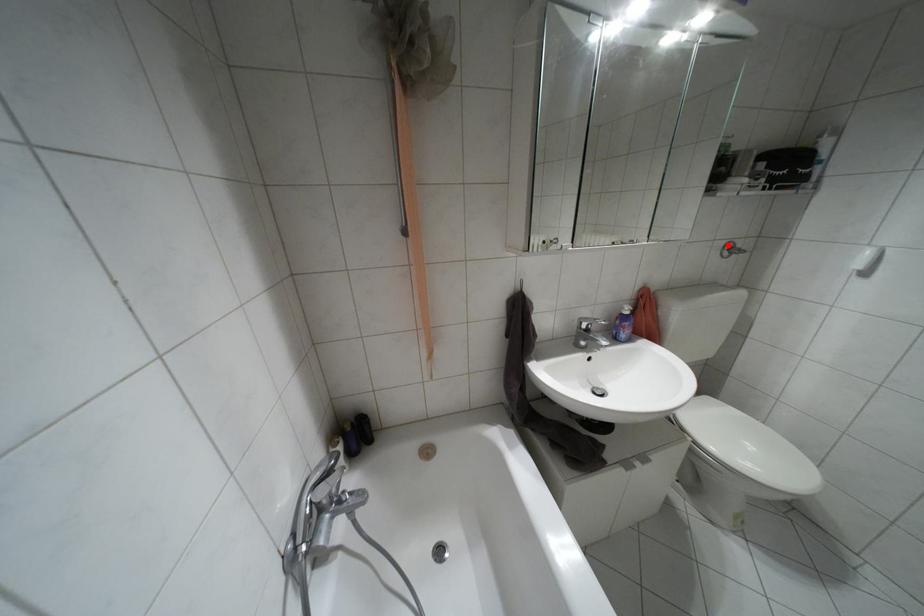
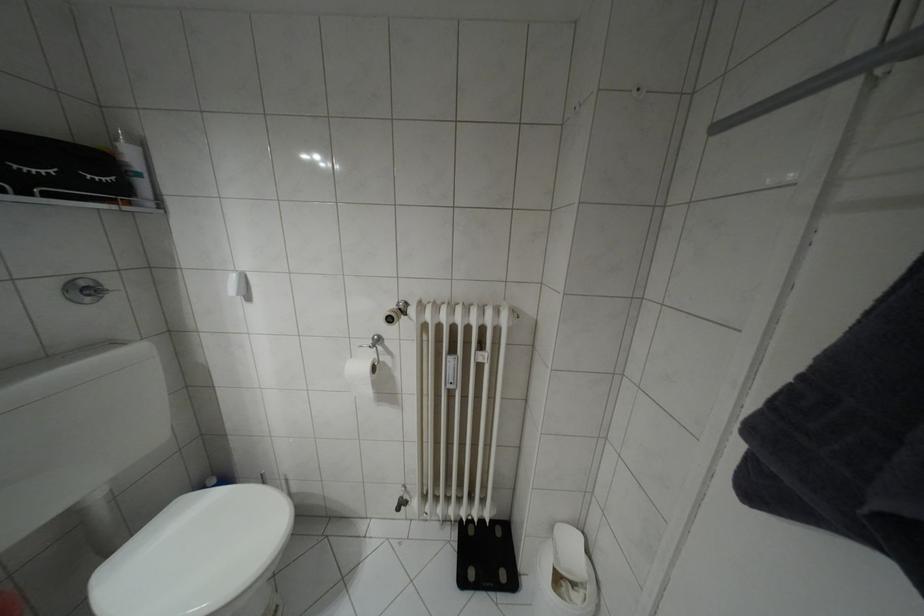
In the second image, find the point that corresponds to the highlighted location in the first image.

(81, 284)